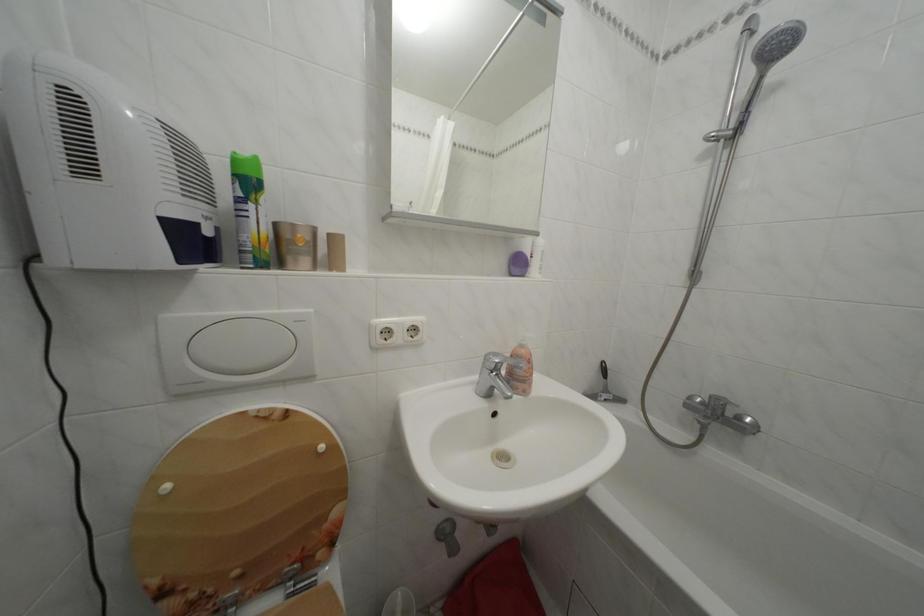
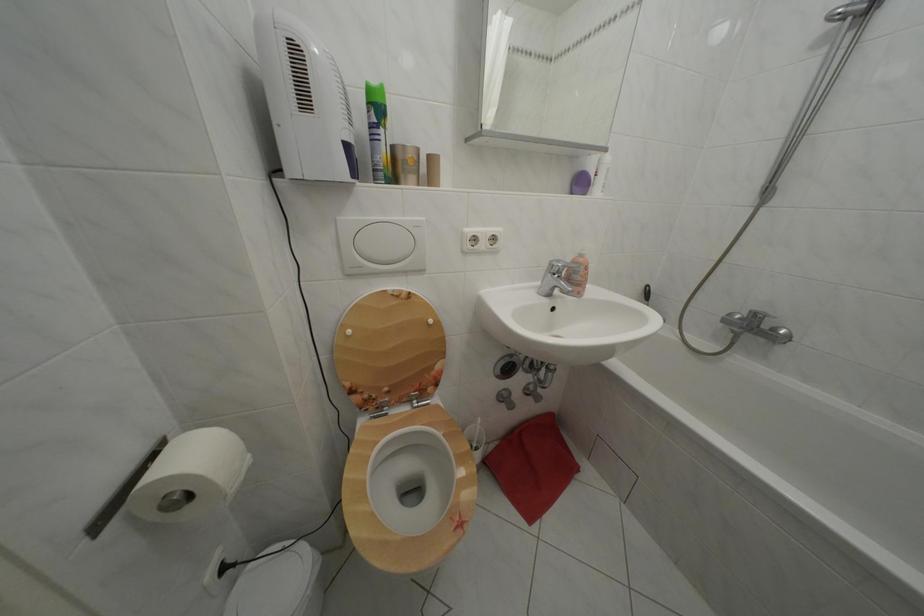
Find the pixel in the second image that matches (x=292, y=589) in the first image.

(419, 407)